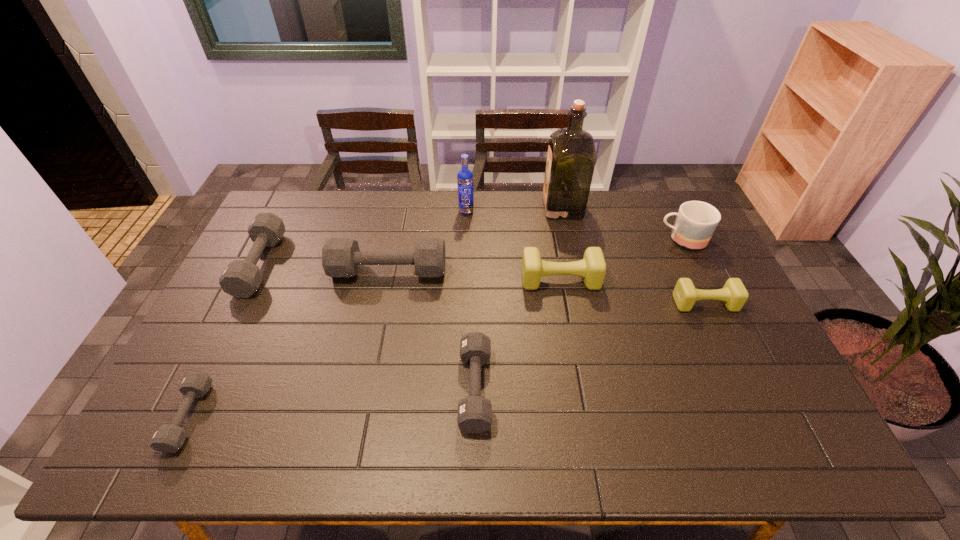
Point out which object is positioned as the second nearest to the second smallest gray dumbbell. Please provide its 2D coordinates. Your answer should be formatted as a tuple, i.e. [(x, y)], where the tuple contains the x and y coordinates of a point satisfying the conditions above.

[(341, 257)]

The image size is (960, 540). Identify the location of the sixth closest dumbbell to the blue mug. (168, 438).

Select which dumbbell is the third closest to the vodka. Please provide its 2D coordinates. Your answer should be formatted as a tuple, i.e. [(x, y)], where the tuple contains the x and y coordinates of a point satisfying the conditions above.

[(474, 415)]

This screenshot has width=960, height=540. I want to click on gray dumbbell identified as the second closest to the shortest object, so click(x=341, y=257).

Choose which gray dumbbell is the fourth nearest neighbor to the bigger olive dumbbell. Please provide its 2D coordinates. Your answer should be formatted as a tuple, i.e. [(x, y)], where the tuple contains the x and y coordinates of a point satisfying the conditions above.

[(168, 438)]

The width and height of the screenshot is (960, 540). Identify the location of free location that satisfies the following two spatial constraints: 1. on the back side of the nearer olive dumbbell; 2. on the label of the liquor. (660, 207).

This screenshot has height=540, width=960. I want to click on vacant region that satisfies the following two spatial constraints: 1. on the front side of the shortest dumbbell; 2. on the right side of the second biggest gray dumbbell, so click(185, 416).

Locate an element on the screen. The height and width of the screenshot is (540, 960). vacant space that satisfies the following two spatial constraints: 1. on the label of the tallest object; 2. on the front side of the rightmost gray dumbbell is located at coordinates (601, 388).